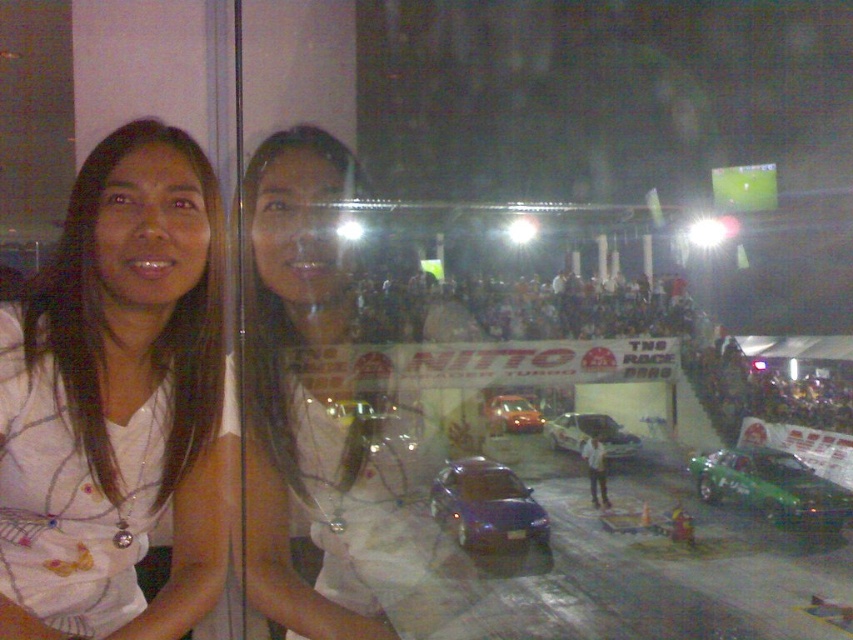
Question: Among these objects, which one is farthest from the camera?

Choices:
 (A) white fabric shirt at left
 (B) shiny purple car at center

Answer: (B)

Question: Which point is farther to the camera?

Choices:
 (A) (606, 417)
 (B) (323, 243)
 (C) (80, 250)
 (D) (646, 484)

Answer: (A)

Question: Does white fabric shirt at left have a smaller size compared to shiny purple car at center?

Choices:
 (A) no
 (B) yes

Answer: (B)

Question: Is white fabric shirt at left above matte blue car at center?

Choices:
 (A) yes
 (B) no

Answer: (A)

Question: Does white fabric shirt at center have a larger size compared to matte blue car at center?

Choices:
 (A) yes
 (B) no

Answer: (A)

Question: Which point appears closest to the camera in this image?

Choices:
 (A) (213, 340)
 (B) (619, 445)
 (C) (532, 417)
 (D) (480, 524)

Answer: (A)